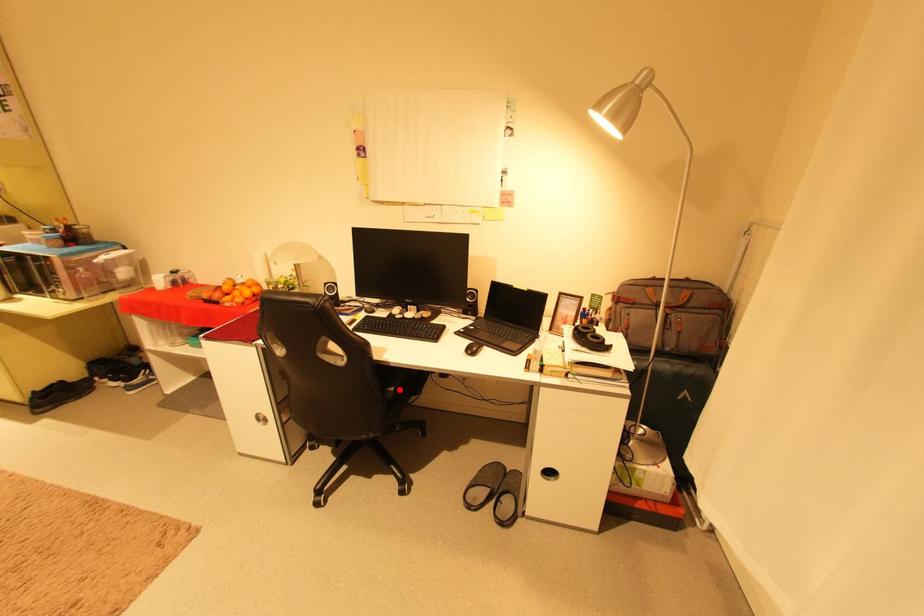
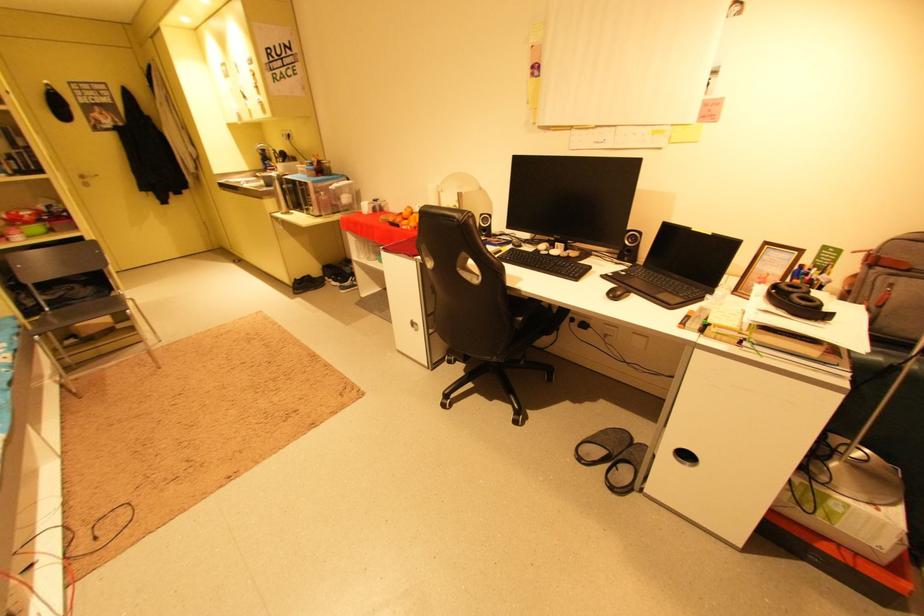
Question: I am providing you with two images of the same scene from different viewpoints. In image1, a red point is highlighted. Considering the same 3D point in image2, which of the following is correct?

Choices:
 (A) It is closer
 (B) It is farther

Answer: (B)